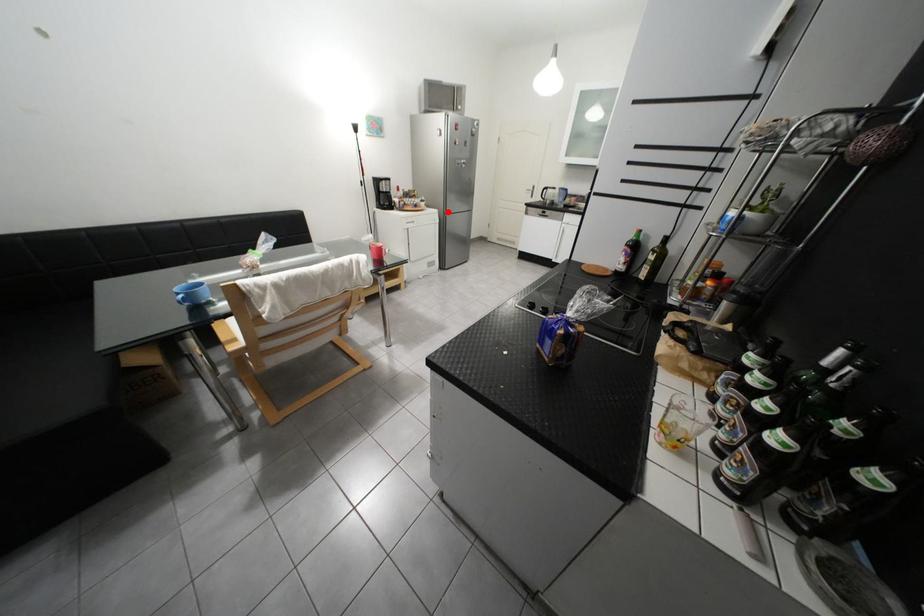
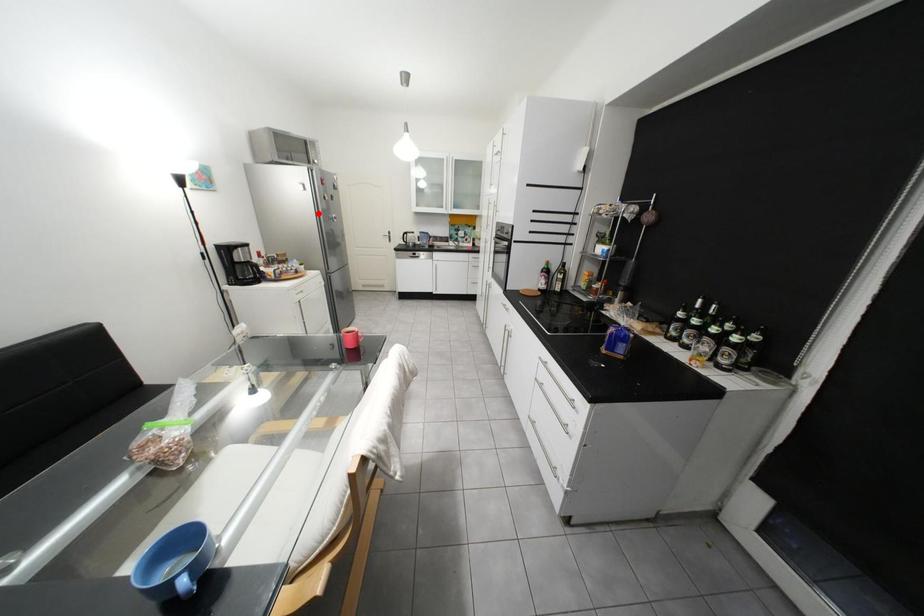
Based on the photo, I am providing you with two images of the same scene from different viewpoints. A red point is marked on the first image and another point is marked on the second image. Are the points marked in image1 and image2 representing the same 3D position?

No